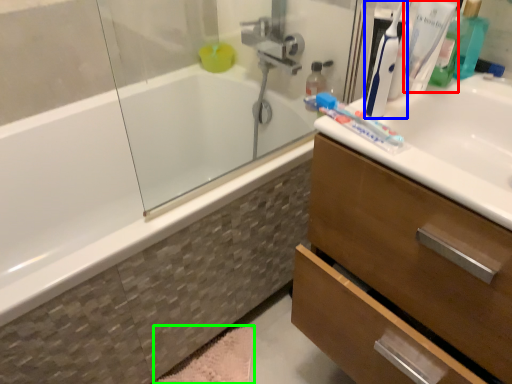
Question: Based on their relative distances, which object is farther from toothbrush (highlighted by a red box)? Choose from toothbrush (highlighted by a blue box) and bath mat (highlighted by a green box).

Choices:
 (A) toothbrush
 (B) bath mat

Answer: (B)